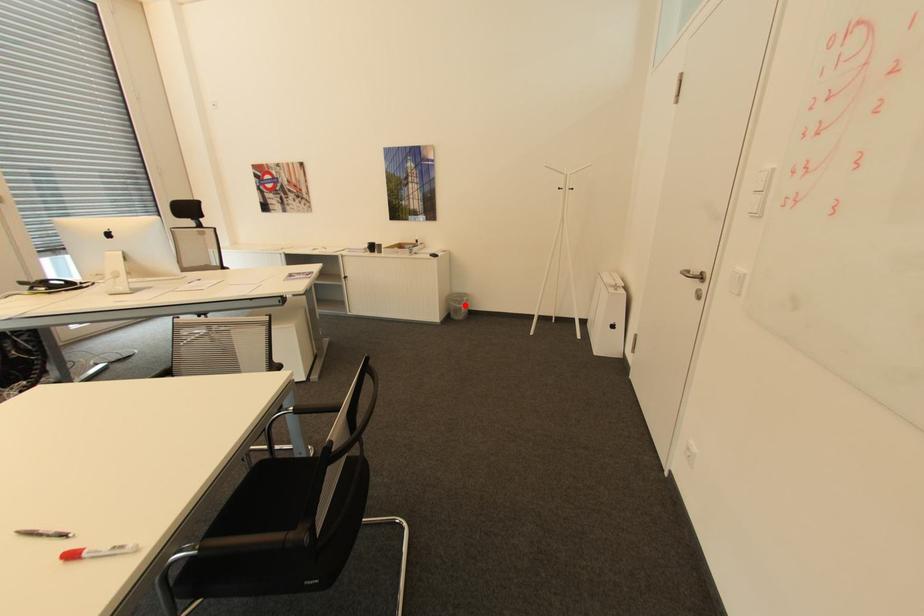
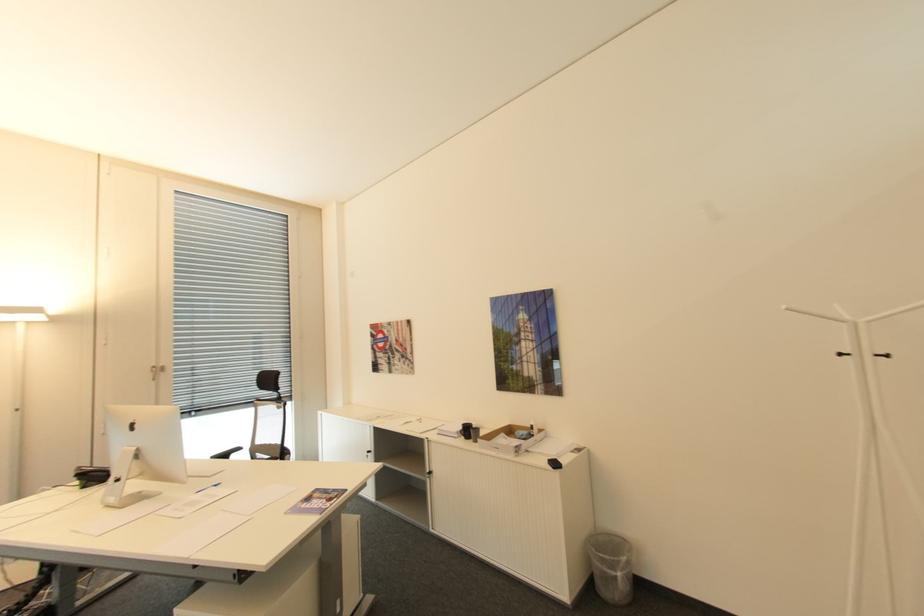
Locate, in the second image, the point that corresponds to the highlighted location in the first image.

(617, 570)